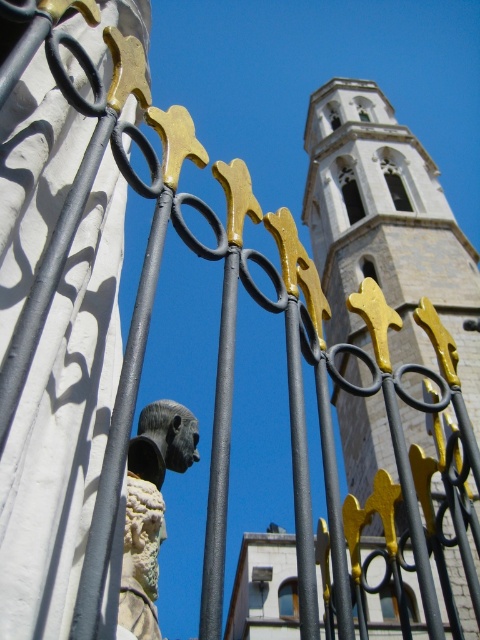
Question: Can you confirm if stone tower at upper center is wider than white stone bust at center?

Choices:
 (A) no
 (B) yes

Answer: (B)

Question: Is stone tower at upper center to the left of white stone bust at center from the viewer's perspective?

Choices:
 (A) no
 (B) yes

Answer: (A)

Question: Which point appears farthest from the camera in this image?

Choices:
 (A) click(131, 445)
 (B) click(387, 460)

Answer: (B)

Question: Considering the relative positions of stone tower at upper center and white stone bust at center in the image provided, where is stone tower at upper center located with respect to white stone bust at center?

Choices:
 (A) below
 (B) above

Answer: (B)

Question: Which point is farther from the camera taking this photo?

Choices:
 (A) (320, 154)
 (B) (130, 442)

Answer: (A)